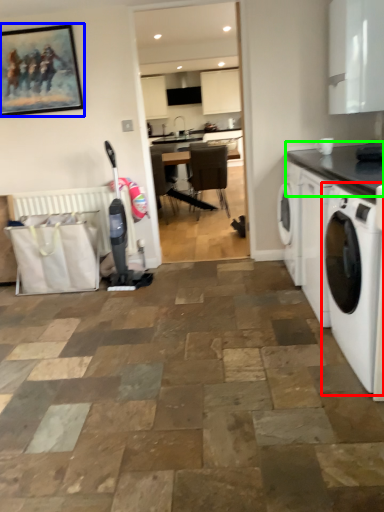
Question: Estimate the real-world distances between objects in this image. Which object is closer to washing machine (highlighted by a red box), picture frame (highlighted by a blue box) or countertop (highlighted by a green box)?

Choices:
 (A) picture frame
 (B) countertop

Answer: (B)